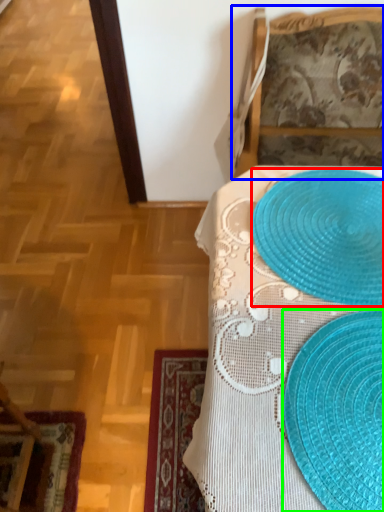
Question: Based on their relative distances, which object is farther from platter (highlighted by a red box)? Choose from furniture (highlighted by a blue box) and straw hat (highlighted by a green box).

Choices:
 (A) furniture
 (B) straw hat

Answer: (A)